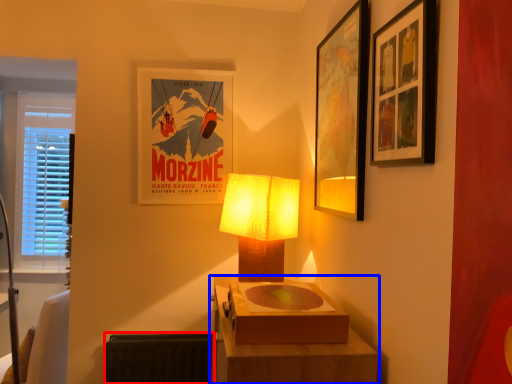
Question: Which point is further to the camera, radiator (highlighted by a red box) or table (highlighted by a blue box)?

Choices:
 (A) radiator
 (B) table

Answer: (A)